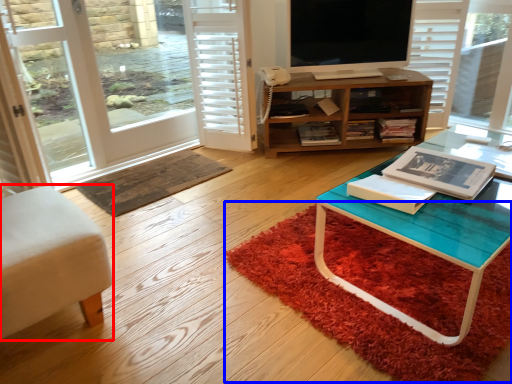
Question: Which of the following is the farthest to the observer, chair (highlighted by a red box) or doormat (highlighted by a blue box)?

Choices:
 (A) chair
 (B) doormat

Answer: (B)